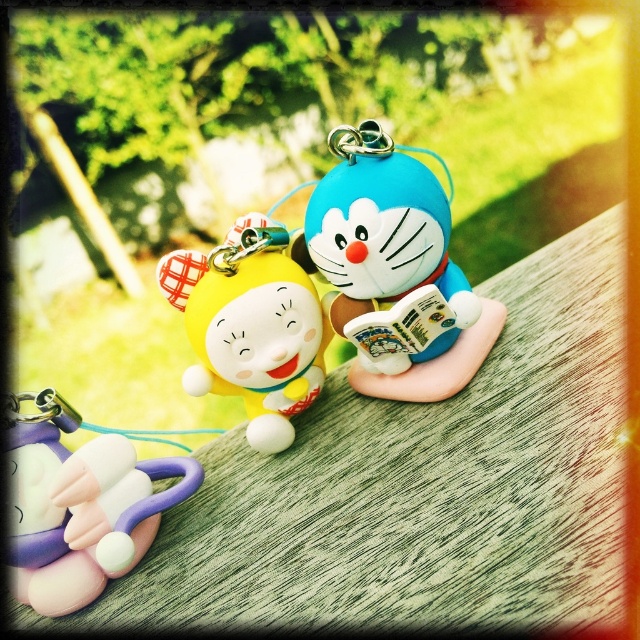
Is matte plastic doraemon at center shorter than yellow matte plush at center?

Incorrect, matte plastic doraemon at center's height does not fall short of yellow matte plush at center's.

Who is shorter, matte plastic doraemon at center or yellow matte plush at center?

yellow matte plush at center is shorter.

Which is in front, point (376, 278) or point (304, 289)?

Point (376, 278) is in front.

Locate an element on the screen. This screenshot has height=640, width=640. matte plastic doraemon at center is located at coordinates (394, 266).

Can you confirm if pink rubber toy at lower left is positioned to the left of yellow matte plush at center?

Indeed, pink rubber toy at lower left is positioned on the left side of yellow matte plush at center.

Looking at this image, who is positioned more to the left, pink rubber toy at lower left or yellow matte plush at center?

pink rubber toy at lower left is more to the left.

This screenshot has height=640, width=640. Find the location of `pink rubber toy at lower left`. pink rubber toy at lower left is located at coordinates (80, 506).

What are the coordinates of `pink rubber toy at lower left` in the screenshot? It's located at (80, 506).

Does matte plastic doraemon at center appear on the right side of pink rubber toy at lower left?

Indeed, matte plastic doraemon at center is positioned on the right side of pink rubber toy at lower left.

Where is `matte plastic doraemon at center`? Image resolution: width=640 pixels, height=640 pixels. matte plastic doraemon at center is located at coordinates (394, 266).

Locate an element on the screen. The height and width of the screenshot is (640, 640). matte plastic doraemon at center is located at coordinates (394, 266).